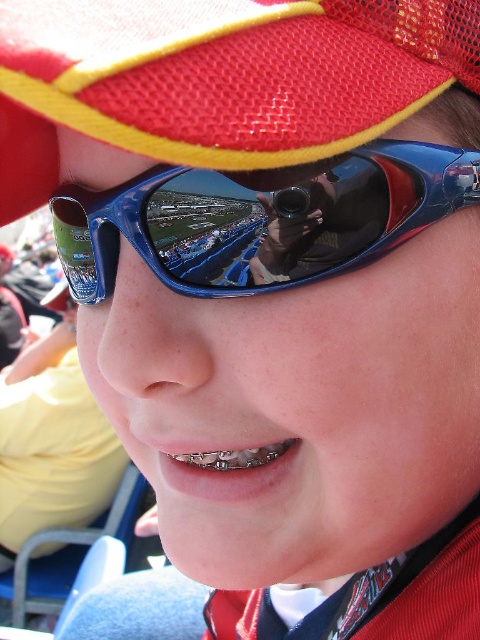
Question: Does red mesh baseball cap at upper center appear on the left side of black satin tie at lower right?

Choices:
 (A) no
 (B) yes

Answer: (B)

Question: Is red mesh baseball cap at upper center above blue shiny sunglasses at center?

Choices:
 (A) yes
 (B) no

Answer: (A)

Question: Observing the image, what is the correct spatial positioning of red mesh baseball cap at upper center in reference to black satin tie at lower right?

Choices:
 (A) right
 (B) left

Answer: (B)

Question: Which point is closer to the camera?

Choices:
 (A) red mesh baseball cap at upper center
 (B) black satin tie at lower right
 (C) blue shiny sunglasses at center

Answer: (A)

Question: Which of these objects is positioned closest to the red mesh baseball cap at upper center?

Choices:
 (A) blue shiny sunglasses at center
 (B) black satin tie at lower right

Answer: (A)

Question: Estimate the real-world distances between objects in this image. Which object is farther from the blue shiny sunglasses at center?

Choices:
 (A) black satin tie at lower right
 (B) red mesh baseball cap at upper center

Answer: (A)